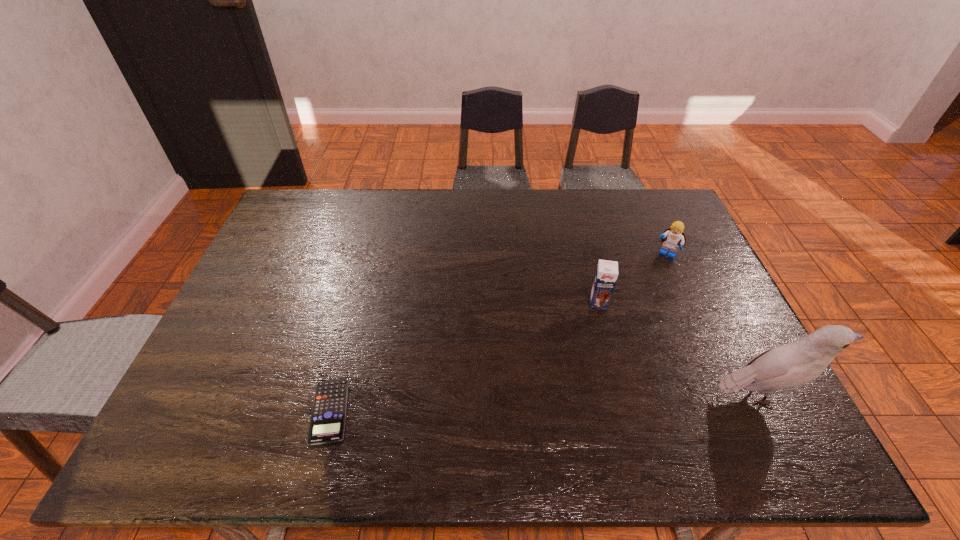
Locate an element on the screen. Image resolution: width=960 pixels, height=540 pixels. free spot located 0.140m on the front label of the chocolate milk is located at coordinates (598, 350).

At what (x,y) coordinates should I click in order to perform the action: click on vacant space located on the front-facing side of the third tallest object. Please return your answer as a coordinate pair (x, y). The width and height of the screenshot is (960, 540). Looking at the image, I should click on (636, 308).

The height and width of the screenshot is (540, 960). In order to click on vacant region located 0.260m on the front-facing side of the third tallest object in this screenshot , I will do 633,313.

Locate an element on the screen. Image resolution: width=960 pixels, height=540 pixels. blank space located 0.390m on the front-facing side of the third tallest object is located at coordinates (616, 345).

Locate an element on the screen. calculator present at the near edge is located at coordinates (327, 424).

Identify the location of bird present at the near edge. (790, 365).

Find the location of a particular element. The height and width of the screenshot is (540, 960). bird that is positioned at the right edge is located at coordinates (790, 365).

At what (x,y) coordinates should I click in order to perform the action: click on Lego located at the right edge. Please return your answer as a coordinate pair (x, y). This screenshot has height=540, width=960. Looking at the image, I should click on (673, 237).

Identify the location of object located at the near right corner. This screenshot has width=960, height=540. (790, 365).

Identify the location of free region at the far edge of the desktop. This screenshot has width=960, height=540. (389, 199).